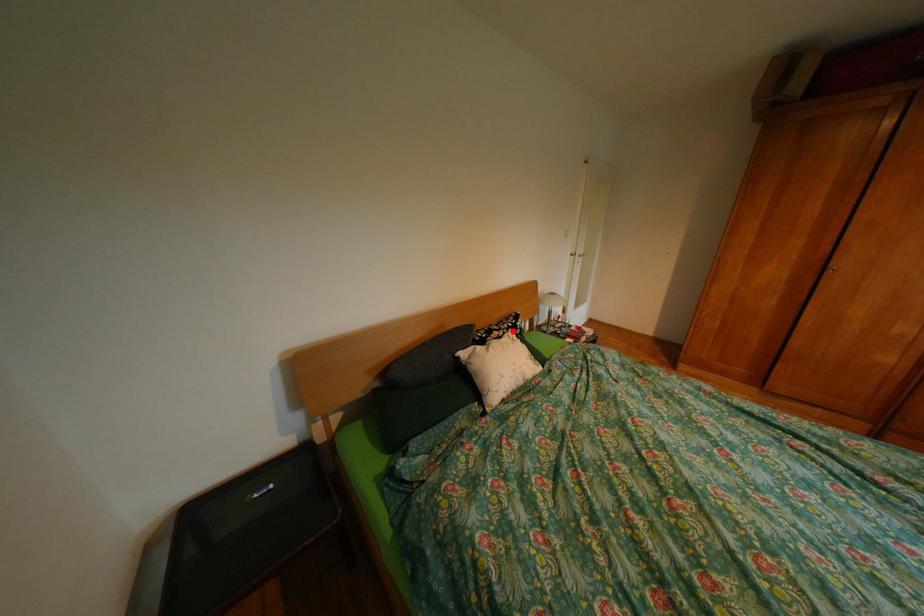
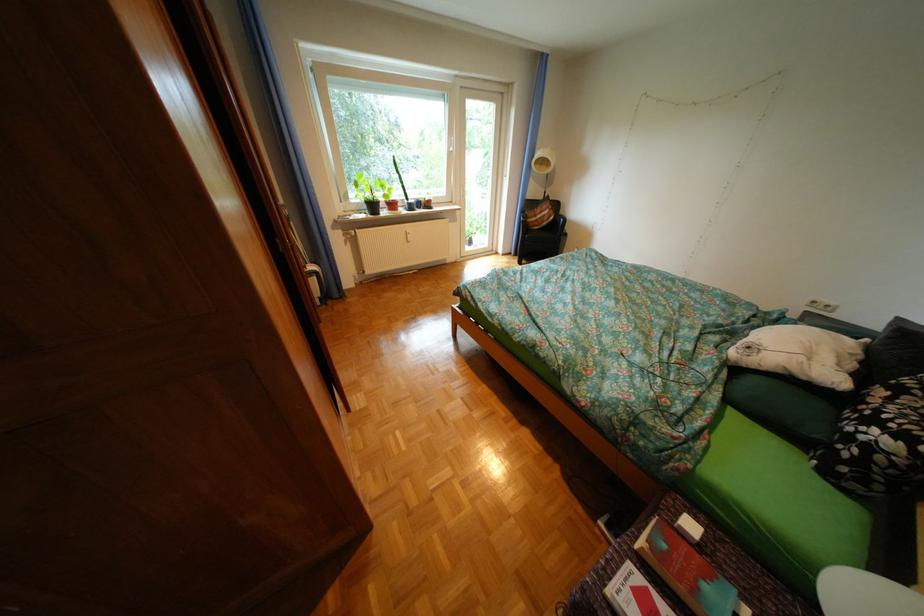
Where in the second image is the point corresponding to the highlighted location from the first image?

(904, 399)